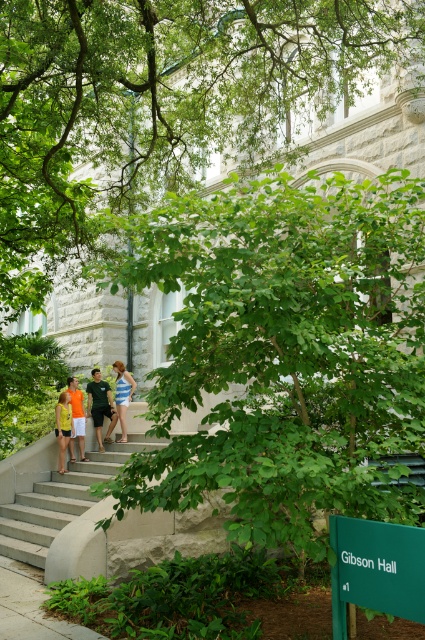
Question: Considering the real-world distances, which object is closest to the orange t-shirt at center?

Choices:
 (A) orange t-shirt at left
 (B) green leafy tree at center
 (C) light gray concrete stairs at center
 (D) green cotton t-shirt at center

Answer: (A)

Question: Which object is the closest to the blue striped dress at center?

Choices:
 (A) light gray concrete stairs at center
 (B) orange t-shirt at left
 (C) orange t-shirt at center
 (D) green cotton t-shirt at center

Answer: (D)

Question: Can you confirm if green leafy tree at center is positioned below light gray concrete stairs at center?

Choices:
 (A) yes
 (B) no

Answer: (B)

Question: Estimate the real-world distances between objects in this image. Which object is closer to the green cotton t-shirt at center?

Choices:
 (A) blue striped dress at center
 (B) orange t-shirt at left

Answer: (A)

Question: Can you confirm if light gray concrete stairs at center is positioned below orange t-shirt at left?

Choices:
 (A) no
 (B) yes

Answer: (B)

Question: Can you confirm if orange t-shirt at left is smaller than orange t-shirt at center?

Choices:
 (A) no
 (B) yes

Answer: (A)